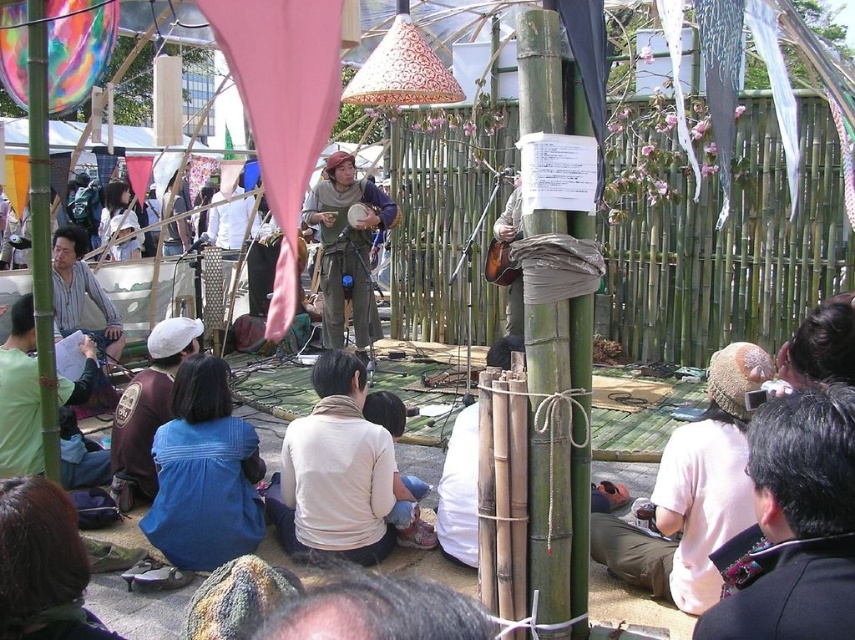
Between green bamboo pole at center and green canvas pants at center, which one is positioned higher?

Positioned higher is green canvas pants at center.

Which is below, green bamboo pole at center or green canvas pants at center?

green bamboo pole at center is below.

Is point (559, 612) in front of point (343, 154)?

Yes.

The width and height of the screenshot is (855, 640). Find the location of `green bamboo pole at center`. green bamboo pole at center is located at coordinates (x=547, y=458).

Is green canvas pants at center bigger than dark brown leather jacket at lower left?

Correct, green canvas pants at center is larger in size than dark brown leather jacket at lower left.

Is green canvas pants at center taller than dark brown leather jacket at lower left?

Indeed, green canvas pants at center has a greater height compared to dark brown leather jacket at lower left.

Is point (352, 243) positioned in front of point (75, 403)?

No, (352, 243) is behind (75, 403).

Identify the location of green canvas pants at center. The width and height of the screenshot is (855, 640). (346, 248).

Which is behind, point (824, 477) or point (119, 484)?

The point (119, 484) is behind.

Is point (821, 609) behind point (152, 492)?

No, (821, 609) is closer to viewer.

Which is in front, point (842, 625) or point (116, 483)?

Positioned in front is point (842, 625).

You are a GUI agent. You are given a task and a screenshot of the screen. Output one action in this format:
    pyautogui.click(x=<x>, y=<y>)
    Task: Click on the dark brown suit at lower right
    The width and height of the screenshot is (855, 640).
    Given the screenshot: What is the action you would take?
    pyautogui.click(x=793, y=525)